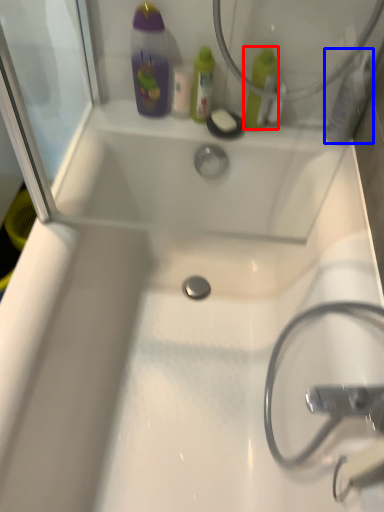
Question: Which object is closer to the camera taking this photo, mouthwash (highlighted by a red box) or mouthwash (highlighted by a blue box)?

Choices:
 (A) mouthwash
 (B) mouthwash

Answer: (B)